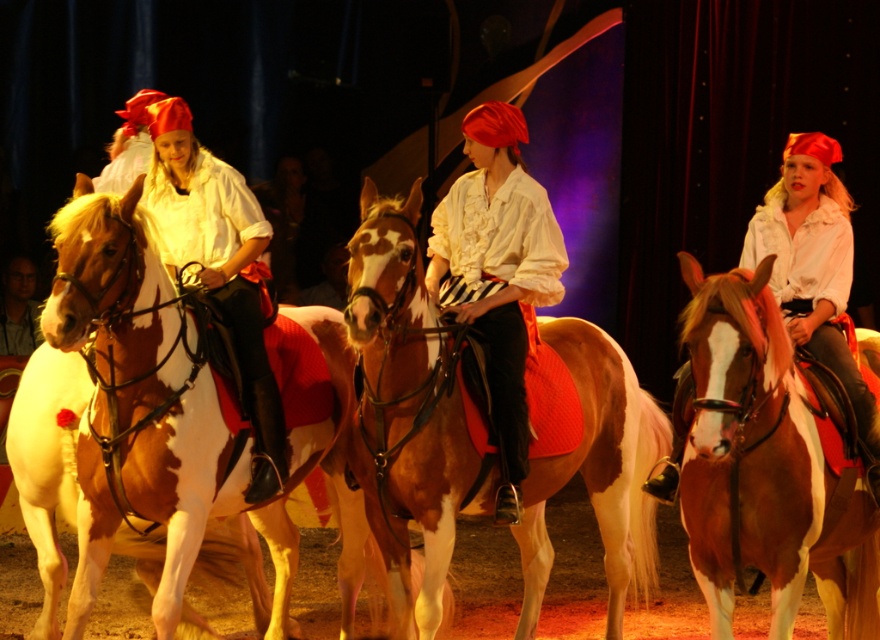
Question: Does brown and white speckled horse at center appear over brown glossy horse at center?

Choices:
 (A) no
 (B) yes

Answer: (B)

Question: Based on their relative distances, which object is farther from the brown and white speckled horse at center?

Choices:
 (A) brown glossy horse at center
 (B) matte white shirt at center

Answer: (A)

Question: Does brown and white speckled horse at center appear over brown glossy horse at center?

Choices:
 (A) yes
 (B) no

Answer: (A)

Question: Among these objects, which one is farthest from the camera?

Choices:
 (A) matte white shirt at center
 (B) brown speckled horse at center
 (C) brown glossy horse at center
 (D) brown and white speckled horse at center

Answer: (A)

Question: Which object is closer to the camera taking this photo?

Choices:
 (A) brown speckled horse at center
 (B) brown glossy horse at center
 (C) matte white shirt at center
 (D) brown and white speckled horse at center

Answer: (B)

Question: Does brown glossy horse at center appear over matte white shirt at center?

Choices:
 (A) yes
 (B) no

Answer: (B)